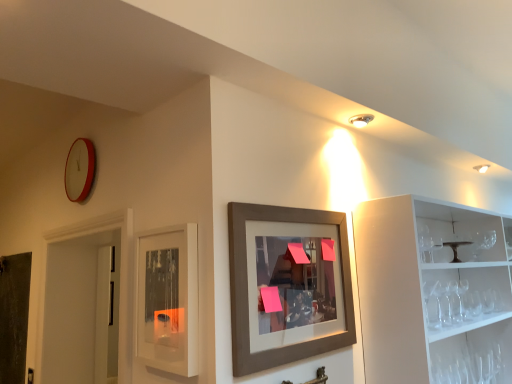
Question: Should I look upward or downward to see metallic silver faucet at lower center?

Choices:
 (A) up
 (B) down

Answer: (B)

Question: Does metallic dark brown cake stand at right turn towards matte glass cabinet at center?

Choices:
 (A) yes
 (B) no

Answer: (B)

Question: Considering the relative sizes of metallic dark brown cake stand at right and matte glass cabinet at center in the image provided, is metallic dark brown cake stand at right smaller than matte glass cabinet at center?

Choices:
 (A) yes
 (B) no

Answer: (A)

Question: Is metallic dark brown cake stand at right next to matte glass cabinet at center?

Choices:
 (A) yes
 (B) no

Answer: (B)

Question: From the image's perspective, is metallic dark brown cake stand at right beneath matte glass cabinet at center?

Choices:
 (A) no
 (B) yes

Answer: (A)

Question: From a real-world perspective, is metallic dark brown cake stand at right under matte glass cabinet at center?

Choices:
 (A) yes
 (B) no

Answer: (B)

Question: Is metallic dark brown cake stand at right oriented away from matte glass cabinet at center?

Choices:
 (A) yes
 (B) no

Answer: (B)

Question: Is dark gray matte door at left placed right next to metallic dark brown cake stand at right?

Choices:
 (A) no
 (B) yes

Answer: (A)

Question: Is dark gray matte door at left thinner than metallic dark brown cake stand at right?

Choices:
 (A) no
 (B) yes

Answer: (B)

Question: Does dark gray matte door at left turn towards metallic dark brown cake stand at right?

Choices:
 (A) yes
 (B) no

Answer: (B)

Question: Is dark gray matte door at left to the left of metallic dark brown cake stand at right from the viewer's perspective?

Choices:
 (A) yes
 (B) no

Answer: (A)

Question: Is metallic dark brown cake stand at right surrounded by dark gray matte door at left?

Choices:
 (A) yes
 (B) no

Answer: (B)

Question: From the image's perspective, is dark gray matte door at left over metallic dark brown cake stand at right?

Choices:
 (A) no
 (B) yes

Answer: (A)

Question: Can you confirm if dark gray matte door at left is positioned to the right of matte glass cabinet at center?

Choices:
 (A) no
 (B) yes

Answer: (A)